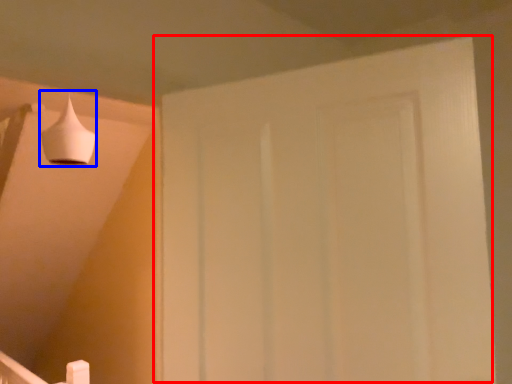
Question: Which of the following is the farthest to the observer, door (highlighted by a red box) or lamp (highlighted by a blue box)?

Choices:
 (A) door
 (B) lamp

Answer: (B)